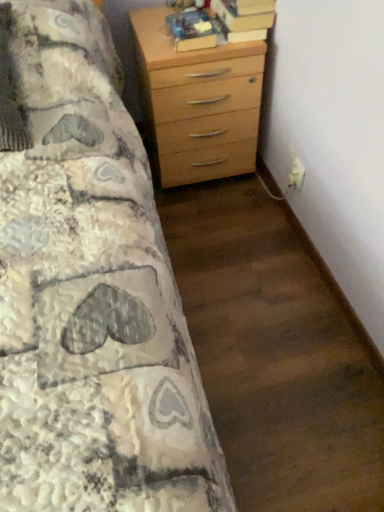
This screenshot has width=384, height=512. Identify the location of hardcover book at upper center, which ranks as the 1th book in left-to-right order. (192, 30).

From the picture: Who is smaller, hardcover book at upper center, which ranks as the 1th book in left-to-right order, or light wood chest of drawers at upper right?

hardcover book at upper center, which ranks as the 1th book in left-to-right order.

Which is more to the right, hardcover book at upper center, which ranks as the 1th book in left-to-right order, or light wood chest of drawers at upper right?

From the viewer's perspective, light wood chest of drawers at upper right appears more on the right side.

Does hardcover book at upper center, marked as the second book in a right-to-left arrangement, have a greater height compared to light wood chest of drawers at upper right?

No.

Which is correct: hardcover book at upper center, marked as the second book in a right-to-left arrangement, is inside light wood chest of drawers at upper right, or outside of it?

hardcover book at upper center, marked as the second book in a right-to-left arrangement, cannot be found inside light wood chest of drawers at upper right.

Does point (191, 33) come behind point (260, 21)?

No, it is not.

In order to click on book behind the hardcover book at upper center, which ranks as the 1th book in left-to-right order in this screenshot , I will do `click(245, 18)`.

Is hardcover book at upper center, marked as the second book in a right-to-left arrangement, not within hardcover book at upper right, the 2th book positioned from the left?

Yes.

Can you confirm if hardcover book at upper center, marked as the second book in a right-to-left arrangement, is taller than hardcover book at upper right, placed as the 1th book when sorted from right to left?

Yes.

From a real-world perspective, relative to hardcover book at upper center, which ranks as the 1th book in left-to-right order, is light wood chest of drawers at upper right vertically above or below?

light wood chest of drawers at upper right is below hardcover book at upper center, which ranks as the 1th book in left-to-right order.

Find the location of a particular element. This screenshot has height=512, width=384. the 1st book positioned above the light wood chest of drawers at upper right (from the image's perspective) is located at coordinates point(192,30).

Can you confirm if light wood chest of drawers at upper right is thinner than hardcover book at upper center, which ranks as the 1th book in left-to-right order?

A: In fact, light wood chest of drawers at upper right might be wider than hardcover book at upper center, which ranks as the 1th book in left-to-right order.

From the picture: Could hardcover book at upper right, placed as the 1th book when sorted from right to left, be considered to be inside light wood chest of drawers at upper right?

Actually, hardcover book at upper right, placed as the 1th book when sorted from right to left, is outside light wood chest of drawers at upper right.

Is light wood chest of drawers at upper right aimed at hardcover book at upper right, placed as the 1th book when sorted from right to left?

No.

Which object is thinner, light wood chest of drawers at upper right or hardcover book at upper right, the 2th book positioned from the left?

hardcover book at upper right, the 2th book positioned from the left.

Between hardcover book at upper right, placed as the 1th book when sorted from right to left, and light wood chest of drawers at upper right, which one has larger size?

With larger size is light wood chest of drawers at upper right.

Considering the sizes of objects hardcover book at upper right, the 2th book positioned from the left, and light wood chest of drawers at upper right in the image provided, who is taller, hardcover book at upper right, the 2th book positioned from the left, or light wood chest of drawers at upper right?

Standing taller between the two is light wood chest of drawers at upper right.

Is hardcover book at upper right, placed as the 1th book when sorted from right to left, oriented towards light wood chest of drawers at upper right?

No, hardcover book at upper right, placed as the 1th book when sorted from right to left, does not turn towards light wood chest of drawers at upper right.

Is the surface of hardcover book at upper right, placed as the 1th book when sorted from right to left, in direct contact with light wood chest of drawers at upper right?

No, hardcover book at upper right, placed as the 1th book when sorted from right to left, is not beside light wood chest of drawers at upper right.

Relative to hardcover book at upper center, which ranks as the 1th book in left-to-right order, is hardcover book at upper right, placed as the 1th book when sorted from right to left, in front or behind?

hardcover book at upper right, placed as the 1th book when sorted from right to left, is behind hardcover book at upper center, which ranks as the 1th book in left-to-right order.

Is hardcover book at upper right, placed as the 1th book when sorted from right to left, wider or thinner than hardcover book at upper center, marked as the second book in a right-to-left arrangement?

In the image, hardcover book at upper right, placed as the 1th book when sorted from right to left, appears to be wider than hardcover book at upper center, marked as the second book in a right-to-left arrangement.

Considering the relative sizes of hardcover book at upper right, placed as the 1th book when sorted from right to left, and hardcover book at upper center, which ranks as the 1th book in left-to-right order, in the image provided, is hardcover book at upper right, placed as the 1th book when sorted from right to left, bigger than hardcover book at upper center, which ranks as the 1th book in left-to-right order,?

Indeed, hardcover book at upper right, placed as the 1th book when sorted from right to left, has a larger size compared to hardcover book at upper center, which ranks as the 1th book in left-to-right order.

Considering the sizes of objects hardcover book at upper right, placed as the 1th book when sorted from right to left, and hardcover book at upper center, marked as the second book in a right-to-left arrangement, in the image provided, who is taller, hardcover book at upper right, placed as the 1th book when sorted from right to left, or hardcover book at upper center, marked as the second book in a right-to-left arrangement,?

hardcover book at upper center, marked as the second book in a right-to-left arrangement, is taller.

Which book is the 1st one when counting from the back of the light wood chest of drawers at upper right? Please provide its 2D coordinates.

[(192, 30)]

Find the location of a particular element. book on the left of hardcover book at upper right, the 2th book positioned from the left is located at coordinates (192, 30).

Considering their positions, is hardcover book at upper center, which ranks as the 1th book in left-to-right order, positioned closer to hardcover book at upper right, placed as the 1th book when sorted from right to left, than light wood chest of drawers at upper right?

hardcover book at upper center, which ranks as the 1th book in left-to-right order, lies closer to hardcover book at upper right, placed as the 1th book when sorted from right to left, than the other object.

Considering their positions, is hardcover book at upper right, placed as the 1th book when sorted from right to left, positioned further to hardcover book at upper center, marked as the second book in a right-to-left arrangement, than light wood chest of drawers at upper right?

Based on the image, light wood chest of drawers at upper right appears to be further to hardcover book at upper center, marked as the second book in a right-to-left arrangement.

Estimate the real-world distances between objects in this image. Which object is closer to hardcover book at upper right, the 2th book positioned from the left, light wood chest of drawers at upper right or hardcover book at upper center, which ranks as the 1th book in left-to-right order?

hardcover book at upper center, which ranks as the 1th book in left-to-right order, is positioned closer to the anchor hardcover book at upper right, the 2th book positioned from the left.

When comparing their distances from hardcover book at upper center, marked as the second book in a right-to-left arrangement, does light wood chest of drawers at upper right or hardcover book at upper right, the 2th book positioned from the left, seem further?

The object further to hardcover book at upper center, marked as the second book in a right-to-left arrangement, is light wood chest of drawers at upper right.

Considering their positions, is hardcover book at upper right, placed as the 1th book when sorted from right to left, positioned closer to light wood chest of drawers at upper right than hardcover book at upper center, marked as the second book in a right-to-left arrangement?

hardcover book at upper center, marked as the second book in a right-to-left arrangement.

Estimate the real-world distances between objects in this image. Which object is closer to light wood chest of drawers at upper right, hardcover book at upper center, which ranks as the 1th book in left-to-right order, or hardcover book at upper right, the 2th book positioned from the left?

hardcover book at upper center, which ranks as the 1th book in left-to-right order, is positioned closer to the anchor light wood chest of drawers at upper right.

Image resolution: width=384 pixels, height=512 pixels. Identify the location of book between hardcover book at upper right, placed as the 1th book when sorted from right to left, and light wood chest of drawers at upper right in the up-down direction. (192, 30).